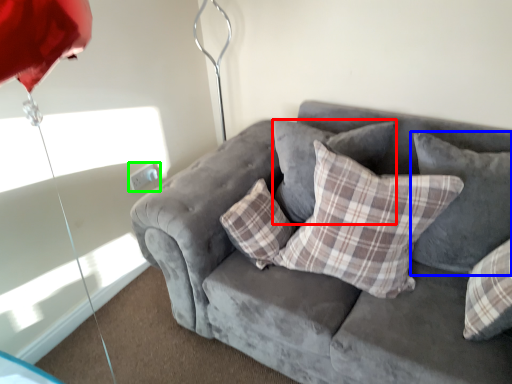
Question: Considering the real-world distances, which object is farthest from pillow (highlighted by a red box)? pillow (highlighted by a blue box) or electric outlet (highlighted by a green box)?

Choices:
 (A) pillow
 (B) electric outlet

Answer: (B)